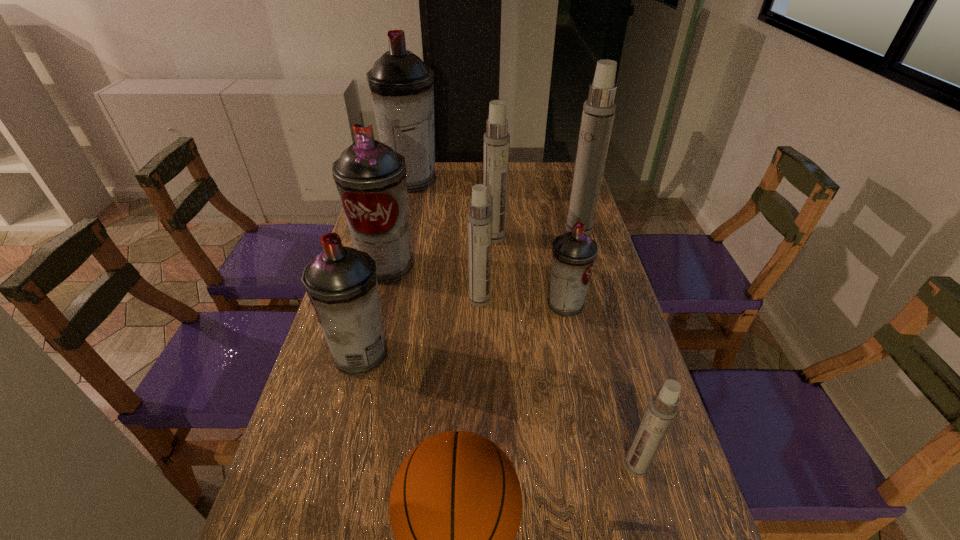
Find the location of a particular element. the farthest object is located at coordinates (402, 88).

Where is `the farthest aerosol can`? This screenshot has width=960, height=540. the farthest aerosol can is located at coordinates (402, 88).

Locate an element on the screen. the biggest white aerosol can is located at coordinates (598, 114).

Find the location of `the fourth farthest aerosol can`. the fourth farthest aerosol can is located at coordinates (370, 176).

You are a GUI agent. You are given a task and a screenshot of the screen. Output one action in this format:
    pyautogui.click(x=<x>, y=<y>)
    Task: Click on the sixth nearest object
    This screenshot has width=960, height=540.
    Given the screenshot: What is the action you would take?
    pyautogui.click(x=370, y=176)

Image resolution: width=960 pixels, height=540 pixels. What are the coordinates of `the third smallest white aerosol can` in the screenshot? It's located at (496, 146).

Locate an element on the screen. The height and width of the screenshot is (540, 960). the second nearest white aerosol can is located at coordinates (479, 219).

Identify the location of the seventh farthest object. The width and height of the screenshot is (960, 540). (341, 282).

You are a GUI agent. You are given a task and a screenshot of the screen. Output one action in this format:
    pyautogui.click(x=<x>, y=<y>)
    Task: Click on the second smallest gray aerosol can
    The height and width of the screenshot is (540, 960).
    Given the screenshot: What is the action you would take?
    pyautogui.click(x=341, y=282)

I want to click on the second nearest gray aerosol can, so click(574, 253).